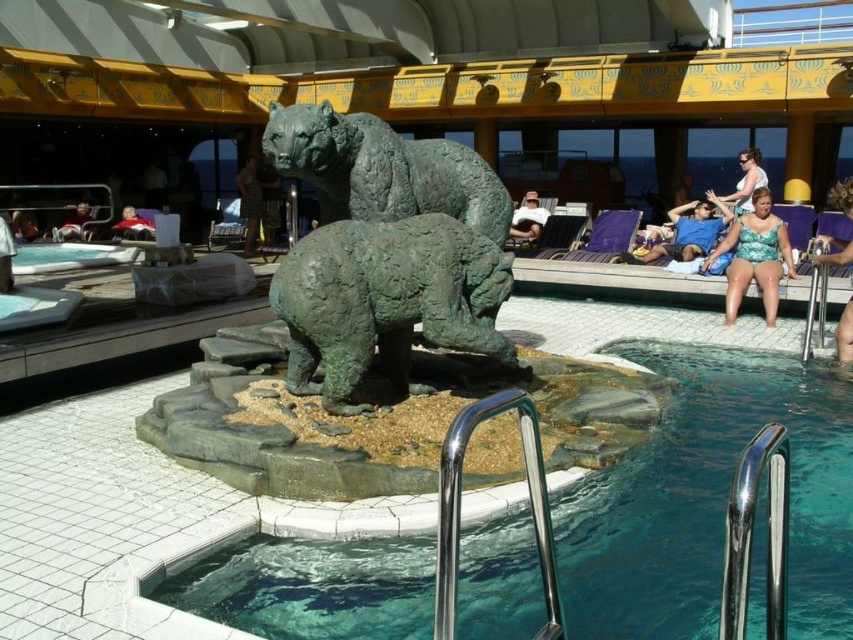
Question: Observing the image, what is the correct spatial positioning of matte blue swimsuit at center right in reference to matte black bear at upper left?

Choices:
 (A) above
 (B) below

Answer: (B)

Question: Which point is closer to the camera?

Choices:
 (A) (79, 237)
 (B) (711, 227)
 (C) (113, 232)

Answer: (B)

Question: Is the position of matte green bear at upper right more distant than that of matte green statue at center?

Choices:
 (A) no
 (B) yes

Answer: (A)

Question: Among these objects, which one is farthest from the camera?

Choices:
 (A) matte blue swimsuit at center right
 (B) bronze bear at center
 (C) matte green bear at upper right
 (D) matte green statue at center

Answer: (D)

Question: Which object appears farthest from the camera in this image?

Choices:
 (A) matte purple swimsuit at right
 (B) camouflage fabric shorts at center
 (C) teal glassy water at center

Answer: (B)

Question: Does green patina bear at center appear under green textured swimsuit at right?

Choices:
 (A) no
 (B) yes

Answer: (B)